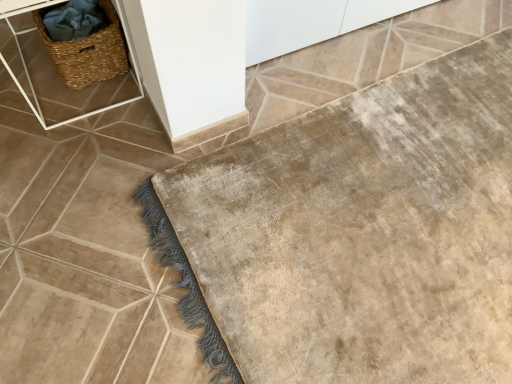
Question: In terms of height, does woven straw basket at upper left look taller or shorter compared to woven brown picnic basket at upper left?

Choices:
 (A) tall
 (B) short

Answer: (A)

Question: From the image's perspective, relative to woven brown picnic basket at upper left, is woven straw basket at upper left above or below?

Choices:
 (A) above
 (B) below

Answer: (A)

Question: Which is farther from the woven brown picnic basket at upper left?

Choices:
 (A) beige plush bath mat at lower right
 (B) woven straw basket at upper left

Answer: (A)

Question: Based on their relative distances, which object is nearer to the beige plush bath mat at lower right?

Choices:
 (A) woven straw basket at upper left
 (B) woven brown picnic basket at upper left

Answer: (A)